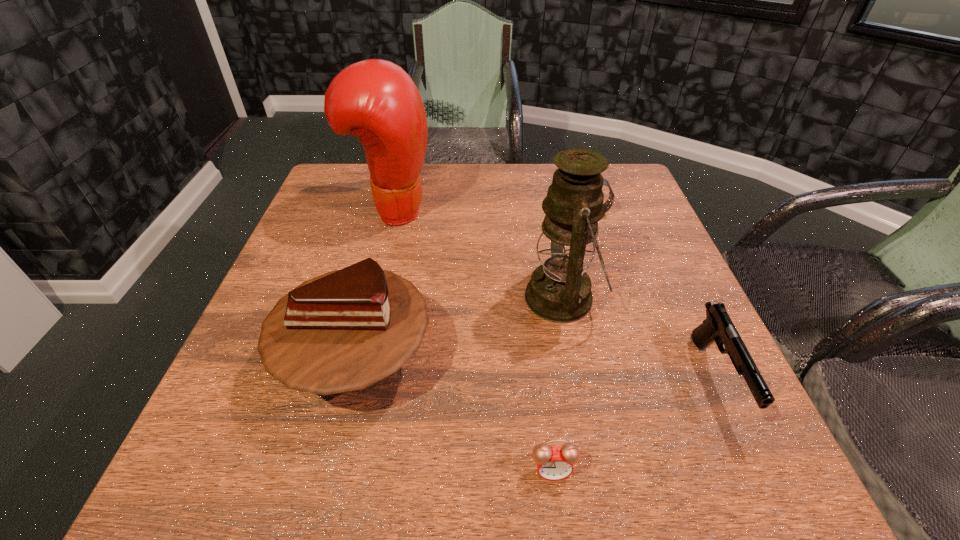
In order to click on boxing glove in this screenshot , I will do `click(375, 100)`.

Locate an element on the screen. This screenshot has height=540, width=960. oil lamp is located at coordinates (559, 291).

What are the coordinates of `cake` in the screenshot? It's located at (342, 331).

I want to click on the rightmost object, so click(x=718, y=327).

Locate an element on the screen. watch is located at coordinates (611, 199).

Where is `the shortest object`? This screenshot has width=960, height=540. the shortest object is located at coordinates (553, 463).

The width and height of the screenshot is (960, 540). In order to click on the nearest object in this screenshot , I will do `click(553, 463)`.

The width and height of the screenshot is (960, 540). In order to click on free location located 0.350m on the striking surface of the boxing glove in this screenshot , I will do `click(567, 210)`.

Locate an element on the screen. vacant area situated 0.260m on the back of the oil lamp is located at coordinates (543, 200).

Locate an element on the screen. This screenshot has width=960, height=540. vacant space located 0.210m on the right of the third tallest object is located at coordinates (548, 361).